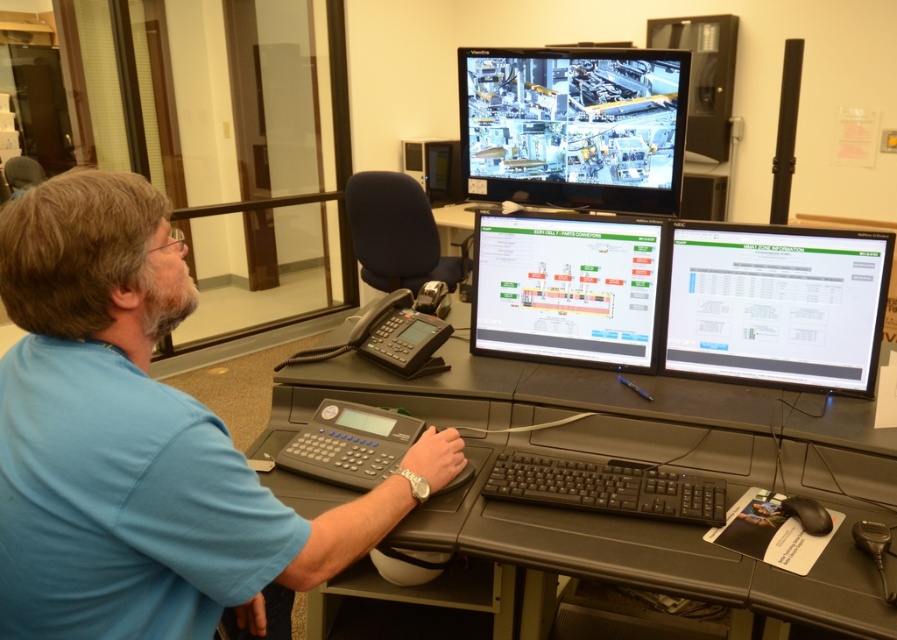
You are a technician in the control room and need to adjust the settings for two points on the factory floor displayed on the large screen. The points are labeled as point 1 at coordinates (800, 392) and point 2 at (403, 141). Based on the image, which point is closer to the control room entrance located at the front of the screen?

Point 1 at coordinates (800, 392) is closer to the control room entrance located at the front of the screen because it is closer to the viewer than point 2 at (403, 141).

You are standing at the point marked as point (676,186) in the factory layout displayed on the large screen. You need to walk to the control room located 10 feet away from your current position. Is the control room within walking distance?

The distance between point (676,186) and the viewer is 6.41 feet. Since the control room is 10 feet away from your current position, it is beyond the 6.41 feet distance, so the control room is not within walking distance.

You are an office worker who needs to place a new document holder between the black plastic computer desk at center and the black glossy monitor at upper center. Based on their positions, which object should the document holder be placed closer to?

The document holder should be placed closer to the black glossy monitor at upper center because the black plastic computer desk at center is positioned to the right of the monitor, meaning the monitor is to the left of the desk. Therefore, the space between them would require placing the holder near the monitor side to maintain alignment.